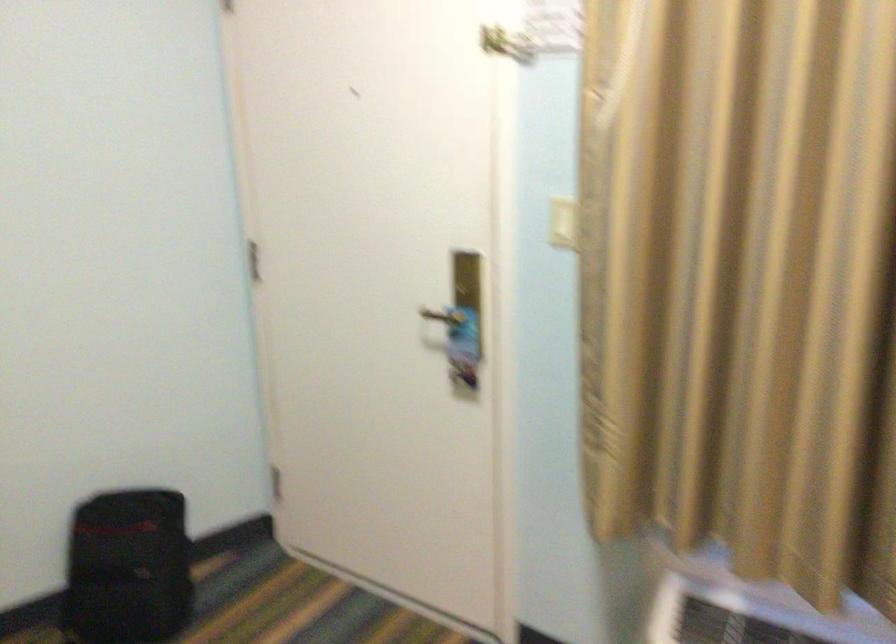
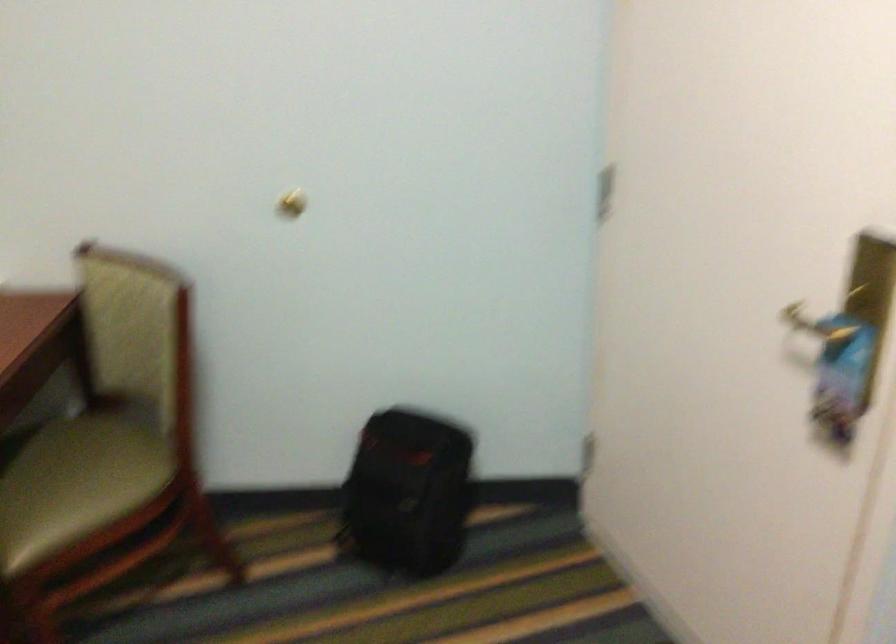
Question: Based on the continuous images, in which direction is the camera rotating? Reply with the corresponding letter.

Choices:
 (A) Left
 (B) Right
 (C) Up
 (D) Down

Answer: (A)